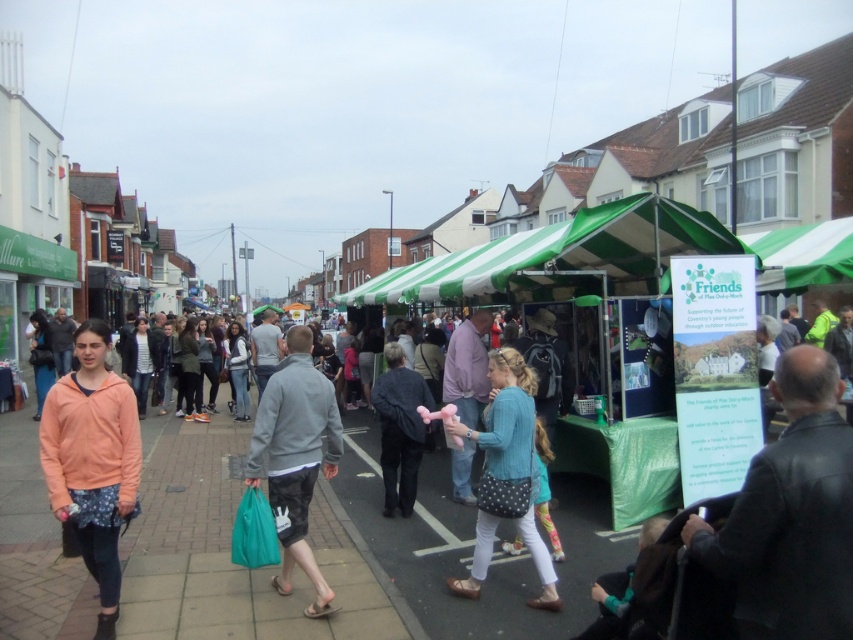
Is leather jacket at lower right further to camera compared to gray fabric jacket at center?

No, it is in front of gray fabric jacket at center.

Can you confirm if leather jacket at lower right is bigger than gray fabric jacket at center?

Incorrect, leather jacket at lower right is not larger than gray fabric jacket at center.

Does point (805, 451) lie behind point (309, 424)?

No, (805, 451) is closer to viewer.

The image size is (853, 640). I want to click on leather jacket at lower right, so click(791, 515).

Can you confirm if leather jacket at lower right is positioned above dark gray textured jacket at center?

Yes.

You are a GUI agent. You are given a task and a screenshot of the screen. Output one action in this format:
    pyautogui.click(x=<x>, y=<y>)
    Task: Click on the leather jacket at lower right
    
    Given the screenshot: What is the action you would take?
    pyautogui.click(x=791, y=515)

Which is behind, point (704, 557) or point (399, 358)?

Point (399, 358)

You are a GUI agent. You are given a task and a screenshot of the screen. Output one action in this format:
    pyautogui.click(x=<x>, y=<y>)
    Task: Click on the leather jacket at lower right
    This screenshot has height=640, width=853.
    Given the screenshot: What is the action you would take?
    pyautogui.click(x=791, y=515)

Which is above, matte peach hoodie at center or gray fabric jacket at center?

matte peach hoodie at center is higher up.

Does matte peach hoodie at center come in front of gray fabric jacket at center?

That is True.

Measure the distance between point (x=85, y=465) and camera.

Point (x=85, y=465) and camera are 14.28 feet apart from each other.

The image size is (853, 640). I want to click on matte peach hoodie at center, so pos(93,460).